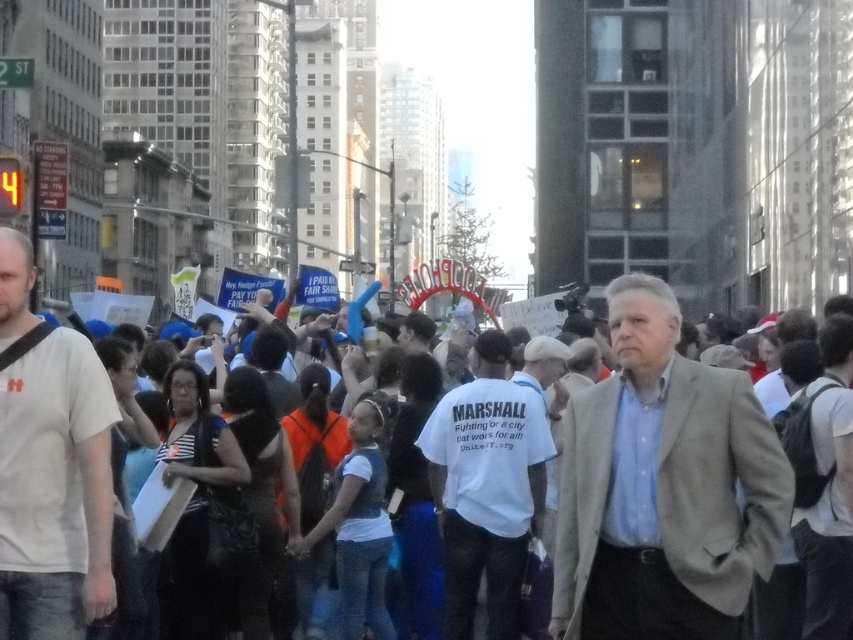
Is point (74, 563) positioned behind point (471, 544)?

That is False.

Can you confirm if white cotton t-shirt at left is positioned to the right of white cotton t-shirt at center?

In fact, white cotton t-shirt at left is to the left of white cotton t-shirt at center.

The image size is (853, 640). What are the coordinates of `white cotton t-shirt at left` in the screenshot? It's located at (55, 490).

The width and height of the screenshot is (853, 640). I want to click on white cotton t-shirt at left, so pyautogui.click(x=55, y=490).

Between point (578, 403) and point (498, 436), which one is positioned in front?

Point (578, 403) is in front.

Is point (579, 580) less distant than point (526, 435)?

Yes, it is.

Who is more forward, [628,356] or [463,499]?

Positioned in front is point [628,356].

Find the location of a particular element. Image resolution: width=853 pixels, height=640 pixels. light gray suit at center is located at coordinates (663, 486).

Who is more forward, (726, 408) or (65, 486)?

Point (65, 486) is more forward.

Who is positioned more to the left, light gray suit at center or white cotton t-shirt at left?

Positioned to the left is white cotton t-shirt at left.

Is point (634, 403) farther from camera compared to point (84, 445)?

Yes.

This screenshot has height=640, width=853. Find the location of `light gray suit at center`. light gray suit at center is located at coordinates (663, 486).